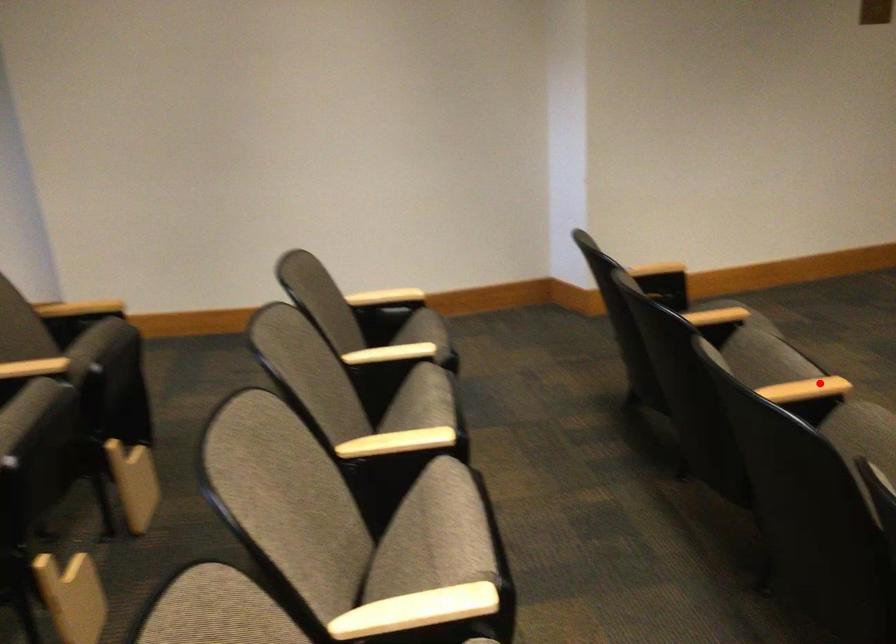
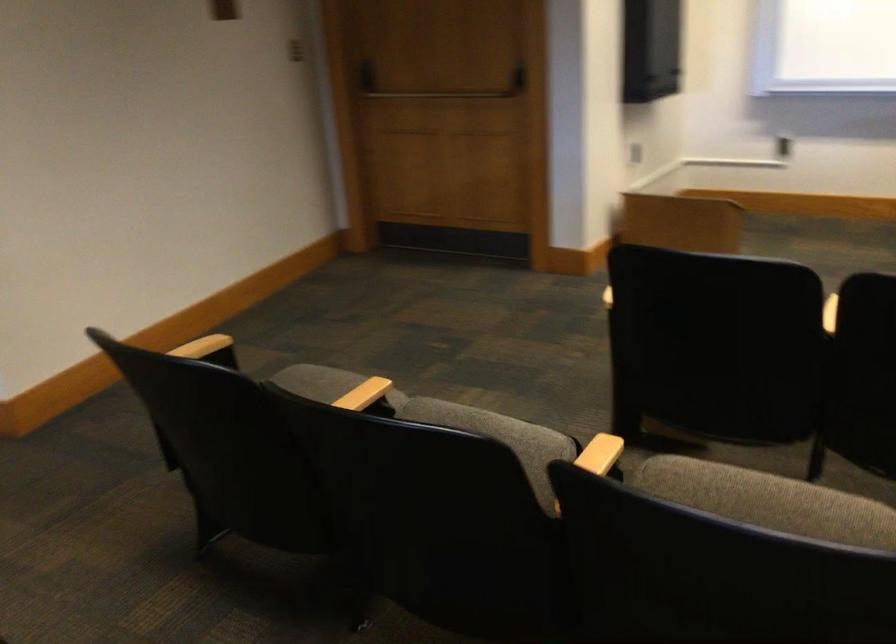
Question: I am providing you with two images of the same scene from different viewpoints. A red point is shown in image1. For the corresponding object point in image2, is it positioned nearer or farther from the camera?

Choices:
 (A) Nearer
 (B) Farther

Answer: (A)